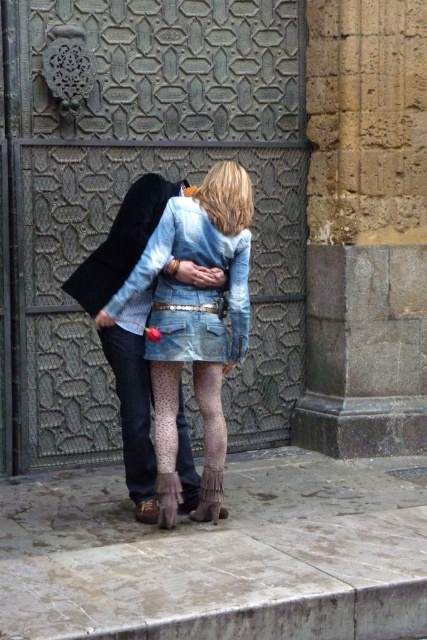
Question: Does denim jacket at center appear under faded denim jacket at lower right?

Choices:
 (A) no
 (B) yes

Answer: (B)

Question: Does denim jacket at center come behind denim skirt at lower center?

Choices:
 (A) no
 (B) yes

Answer: (A)

Question: Is denim jacket at center above denim skirt at lower center?

Choices:
 (A) yes
 (B) no

Answer: (A)

Question: Which of these objects is positioned farthest from the denim jacket at center?

Choices:
 (A) brown suede boot at lower center
 (B) denim skirt at lower center

Answer: (A)

Question: Which point is farther from the camera taking this photo?

Choices:
 (A) 154,268
 (B) 216,493
 (C) 225,257
 (D) 143,412

Answer: (B)

Question: Which of the following is the farthest from the observer?

Choices:
 (A) denim skirt at lower center
 (B) faded denim jacket at lower right
 (C) brown suede boot at lower center

Answer: (C)